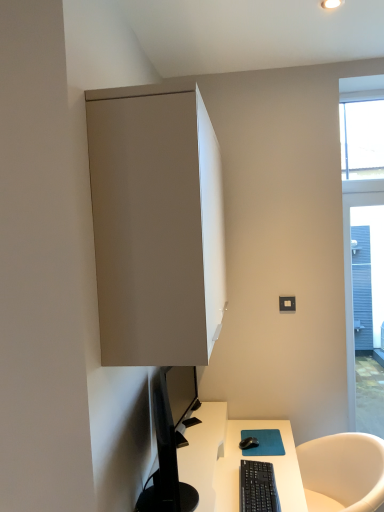
Where is `empty space that is ontop of black plastic keyboard at lower center (from a real-world perspective)`? The width and height of the screenshot is (384, 512). empty space that is ontop of black plastic keyboard at lower center (from a real-world perspective) is located at coordinates (261, 485).